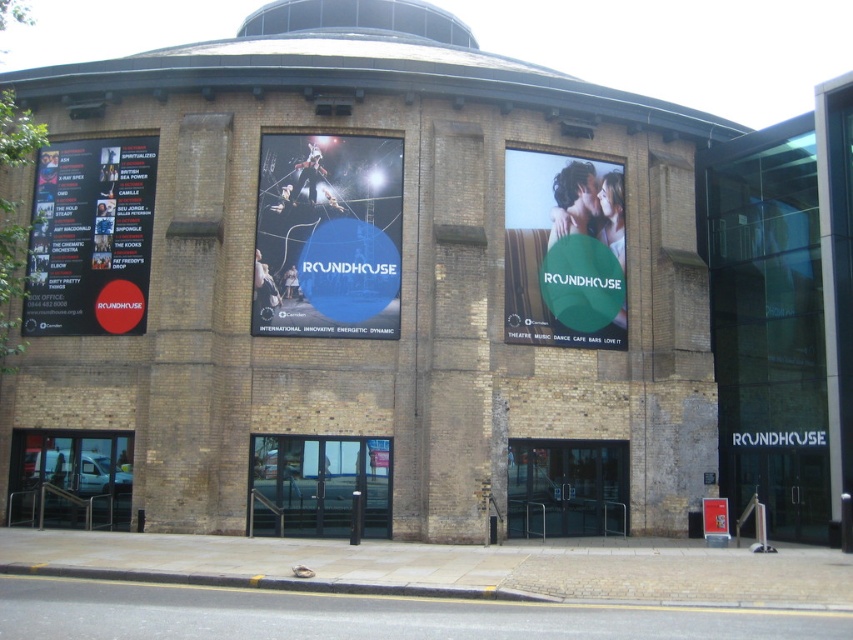
Does point (312, 198) lie in front of point (45, 305)?

Yes.

Is point (396, 282) positioned behind point (103, 145)?

No, it is not.

The image size is (853, 640). I want to click on blue glossy poster at center, so click(328, 236).

I want to click on blue glossy poster at center, so click(x=328, y=236).

Which of these two, blue glossy poster at center or matte green sign at center, stands taller?

matte green sign at center

Is blue glossy poster at center below matte green sign at center?

No, blue glossy poster at center is not below matte green sign at center.

Who is more forward, (281, 336) or (592, 328)?

Positioned in front is point (281, 336).

Where is `blue glossy poster at center`? blue glossy poster at center is located at coordinates (328, 236).

Can you confirm if black paper poster at left is positioned to the right of matte green sign at center?

In fact, black paper poster at left is to the left of matte green sign at center.

Does point (114, 150) lie behind point (527, 317)?

Yes, point (114, 150) is farther from viewer.

Describe the element at coordinates (90, 237) in the screenshot. The image size is (853, 640). I see `black paper poster at left` at that location.

The width and height of the screenshot is (853, 640). I want to click on black paper poster at left, so click(x=90, y=237).